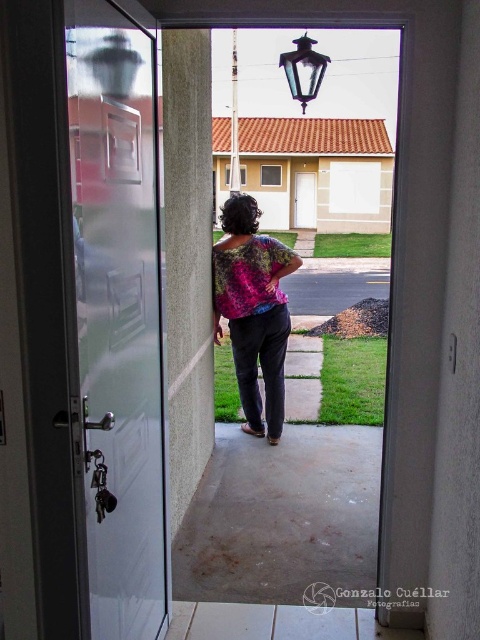
Between frosted glass door at left and white glossy door at center, which one has less height?

With less height is white glossy door at center.

Can you confirm if frosted glass door at left is bigger than white glossy door at center?

No.

The height and width of the screenshot is (640, 480). Describe the element at coordinates (119, 314) in the screenshot. I see `frosted glass door at left` at that location.

Image resolution: width=480 pixels, height=640 pixels. Find the location of `frosted glass door at left`. frosted glass door at left is located at coordinates (119, 314).

Who is shorter, frosted glass door at left or floral fabric blouse at center?

Standing shorter between the two is floral fabric blouse at center.

How far apart are frosted glass door at left and floral fabric blouse at center?

2.20 meters

Who is more distant from viewer, [157,417] or [249,387]?

Point [249,387]

Where is `frosted glass door at left`? The width and height of the screenshot is (480, 640). frosted glass door at left is located at coordinates (119, 314).

Is the position of floral fabric blouse at center more distant than that of white glossy door at center?

No, it is in front of white glossy door at center.

Between point (261, 244) and point (313, 214), which one is positioned behind?

Point (313, 214)

Does point (242, 307) come closer to viewer compared to point (298, 202)?

Yes.

Find the location of a particular element. floral fabric blouse at center is located at coordinates (252, 310).